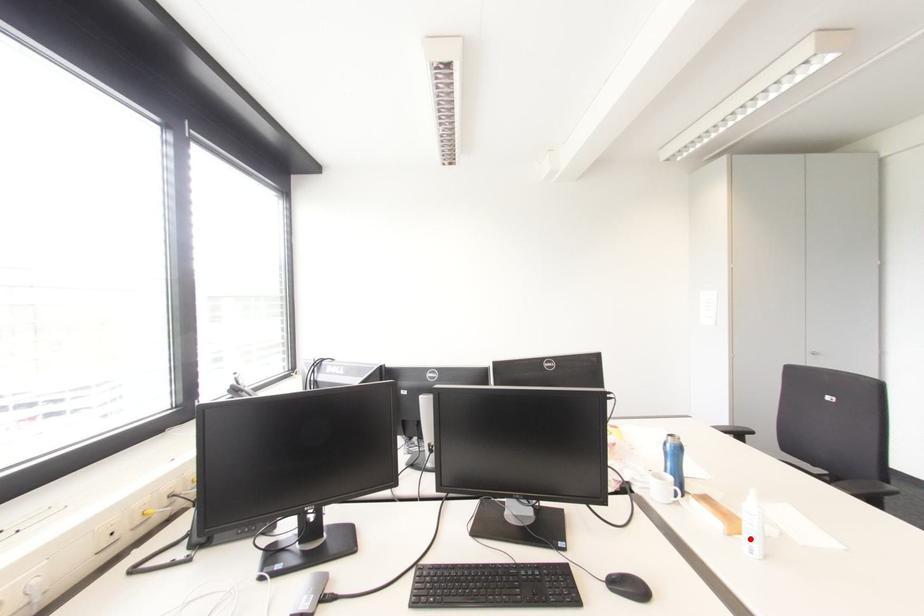
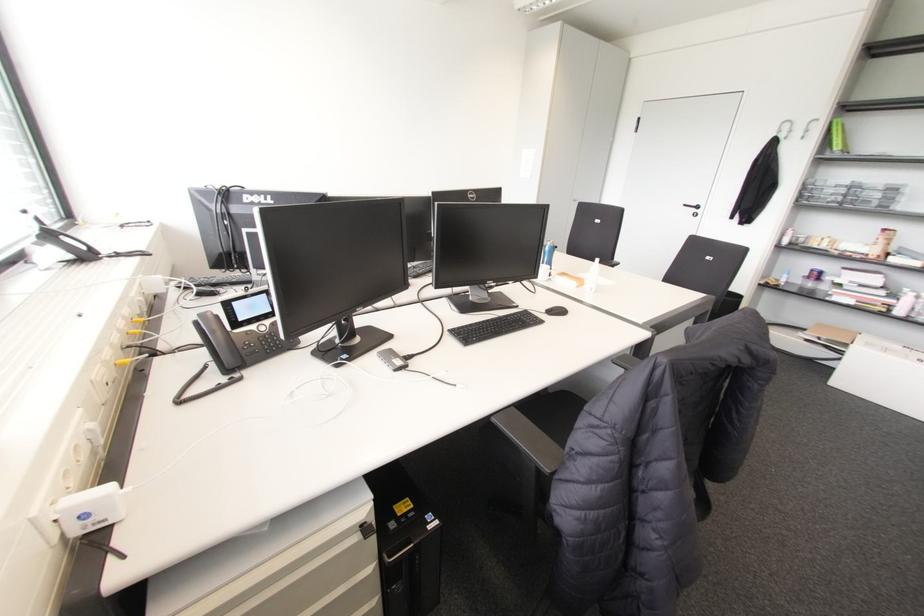
Where in the second image is the point corresponding to the highlighted location from the first image?

(589, 285)